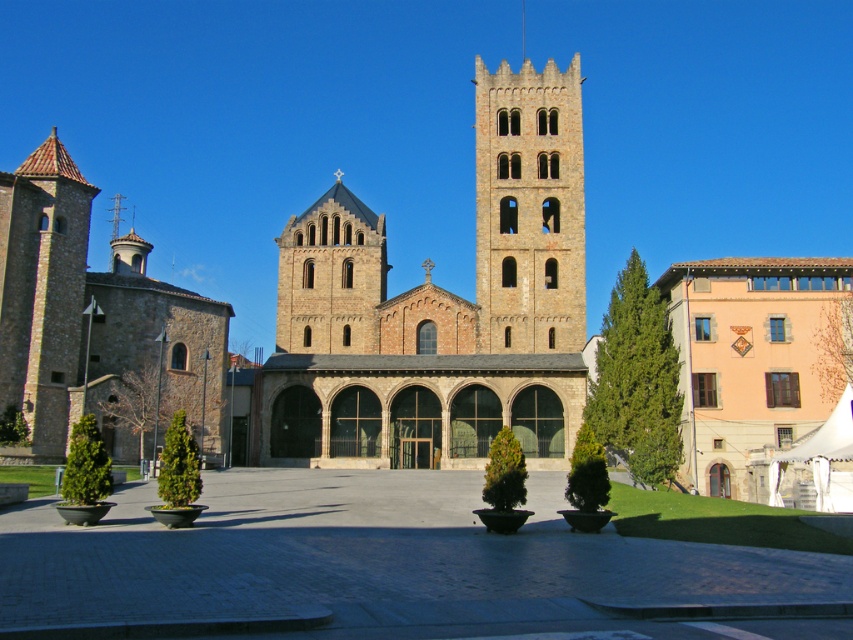
Question: Does brown stone church at center appear over brown stone church at left?

Choices:
 (A) no
 (B) yes

Answer: (B)

Question: Which point appears farthest from the camera in this image?

Choices:
 (A) (306, 323)
 (B) (85, 214)
 (C) (33, 326)
 (D) (550, 429)

Answer: (A)

Question: Is brown stone church at center further to camera compared to smooth stone tower at center?

Choices:
 (A) yes
 (B) no

Answer: (B)

Question: Which of these objects is positioned farthest from the brown stone tower at upper center?

Choices:
 (A) brown stone tower at left
 (B) brown stone church at left
 (C) brown stone church at center
 (D) smooth stone tower at center

Answer: (A)

Question: Is brown stone church at center wider than brown stone church at left?

Choices:
 (A) no
 (B) yes

Answer: (A)

Question: Among these objects, which one is nearest to the camera?

Choices:
 (A) brown stone tower at upper center
 (B) brown stone church at center
 (C) brown stone church at left

Answer: (C)